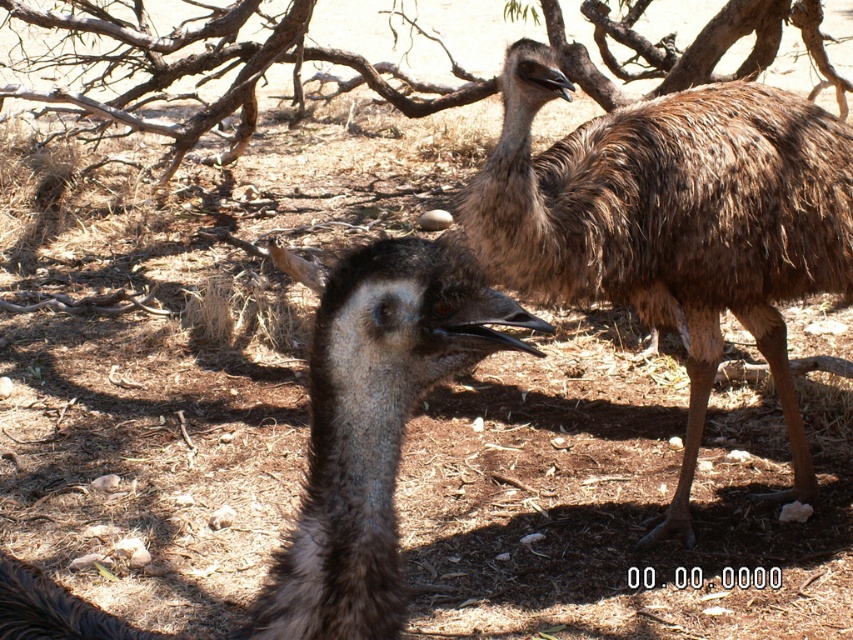
Consider the image. You are a photographer trying to capture both emus in your shot. You notice two points in the image labeled as point 1 at coordinates (660,301) and point 2 at coordinates (387,310). Which point is closer to the camera?

Point 1 at coordinates (660,301) is closer to the camera than point 2 at coordinates (387,310) because it is further to the camera according to the description.

You are a wildlife photographer using a camera with a 2.5 feet focal length. You want to capture the brown feathered ostrich at center in focus. Is the distance sufficient for your camera to focus on it?

The brown feathered ostrich at center is 3.52 feet from the camera. Since the camera has a 2.5 feet focal length, the distance is greater than the focal length, so the camera can focus on the brown feathered ostrich at center.